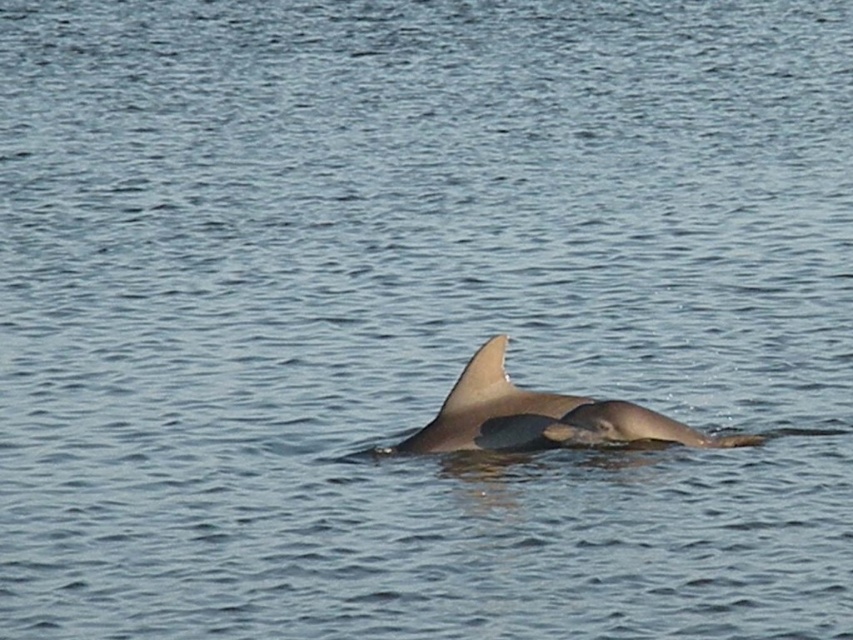
Is point (480, 412) closer to camera compared to point (445, 397)?

No, (480, 412) is further to viewer.

Based on the photo, can you confirm if smooth gray dolphin at center is shorter than smooth gray fin at center?

In fact, smooth gray dolphin at center may be taller than smooth gray fin at center.

Between point (491, 396) and point (509, 392), which one is positioned behind?

Positioned behind is point (509, 392).

Where is `smooth gray dolphin at center`? smooth gray dolphin at center is located at coordinates (538, 417).